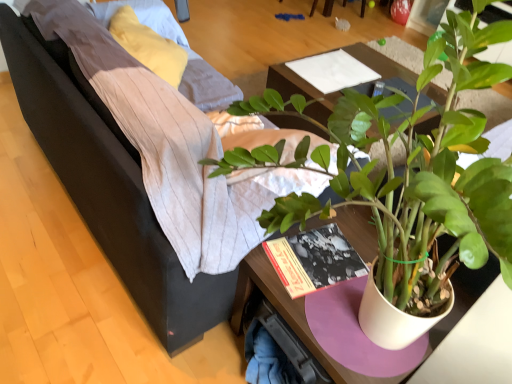
Image resolution: width=512 pixels, height=384 pixels. I want to click on free space above white paper at center (from a real-world perspective), so click(333, 67).